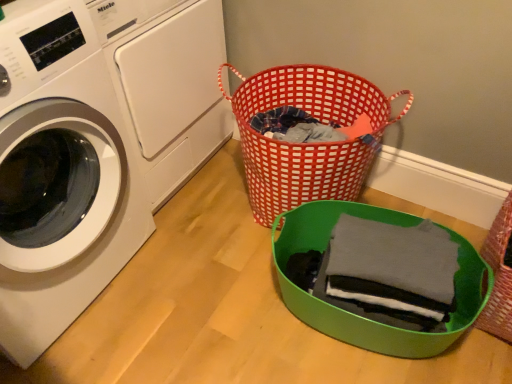
Question: Are rustic woven basket at lower right, the 1th basket viewed from the right, and red woven basket at center, placed as the 3th basket when sorted from right to left, located far from each other?

Choices:
 (A) yes
 (B) no

Answer: (B)

Question: Is rustic woven basket at lower right, the third basket positioned from the left, looking in the opposite direction of red woven basket at center, placed as the 3th basket when sorted from right to left?

Choices:
 (A) no
 (B) yes

Answer: (A)

Question: From a real-world perspective, is rustic woven basket at lower right, the 1th basket viewed from the right, positioned under red woven basket at center, placed as the first basket when sorted from left to right, based on gravity?

Choices:
 (A) yes
 (B) no

Answer: (A)

Question: Does rustic woven basket at lower right, the third basket positioned from the left, have a greater height compared to red woven basket at center, placed as the first basket when sorted from left to right?

Choices:
 (A) no
 (B) yes

Answer: (A)

Question: Is rustic woven basket at lower right, the 1th basket viewed from the right, surrounding red woven basket at center, placed as the 3th basket when sorted from right to left?

Choices:
 (A) yes
 (B) no

Answer: (B)

Question: In the image, is green plastic basket at lower right, positioned as the second basket in right-to-left order, positioned in front of or behind white glossy washing machine at left, which appears as the second washing machine when viewed from the back?

Choices:
 (A) front
 (B) behind

Answer: (B)

Question: Is green plastic basket at lower right, positioned as the second basket in right-to-left order, to the left or to the right of white glossy washing machine at left, arranged as the 1th washing machine when viewed from the front, in the image?

Choices:
 (A) left
 (B) right

Answer: (B)

Question: Is green plastic basket at lower right, positioned as the second basket in right-to-left order, situated inside white glossy washing machine at left, which appears as the second washing machine when viewed from the back, or outside?

Choices:
 (A) outside
 (B) inside

Answer: (A)

Question: Is green plastic basket at lower right, positioned as the second basket in right-to-left order, wider or thinner than white glossy washing machine at left, which appears as the second washing machine when viewed from the back?

Choices:
 (A) wide
 (B) thin

Answer: (B)

Question: Considering the positions of white glossy washing machine at left, which appears as the second washing machine when viewed from the back, and white glossy washing machine at upper left, which ranks as the second washing machine in front-to-back order, in the image, is white glossy washing machine at left, which appears as the second washing machine when viewed from the back, taller or shorter than white glossy washing machine at upper left, which ranks as the second washing machine in front-to-back order,?

Choices:
 (A) short
 (B) tall

Answer: (B)

Question: From a real-world perspective, is white glossy washing machine at left, which appears as the second washing machine when viewed from the back, physically located above or below white glossy washing machine at upper left, which ranks as the second washing machine in front-to-back order?

Choices:
 (A) below
 (B) above

Answer: (B)

Question: From the image's perspective, relative to white glossy washing machine at upper left, arranged as the first washing machine when viewed from the back, is white glossy washing machine at left, which appears as the second washing machine when viewed from the back, above or below?

Choices:
 (A) below
 (B) above

Answer: (A)

Question: Is white glossy washing machine at left, arranged as the 1th washing machine when viewed from the front, inside the boundaries of white glossy washing machine at upper left, arranged as the first washing machine when viewed from the back, or outside?

Choices:
 (A) inside
 (B) outside

Answer: (B)

Question: Is point [x=148, y=56] closer or farther from the camera than point [x=335, y=110]?

Choices:
 (A) farther
 (B) closer

Answer: (B)

Question: From the image's perspective, is white glossy washing machine at upper left, arranged as the first washing machine when viewed from the back, above or below red woven basket at center, placed as the 3th basket when sorted from right to left?

Choices:
 (A) below
 (B) above

Answer: (B)